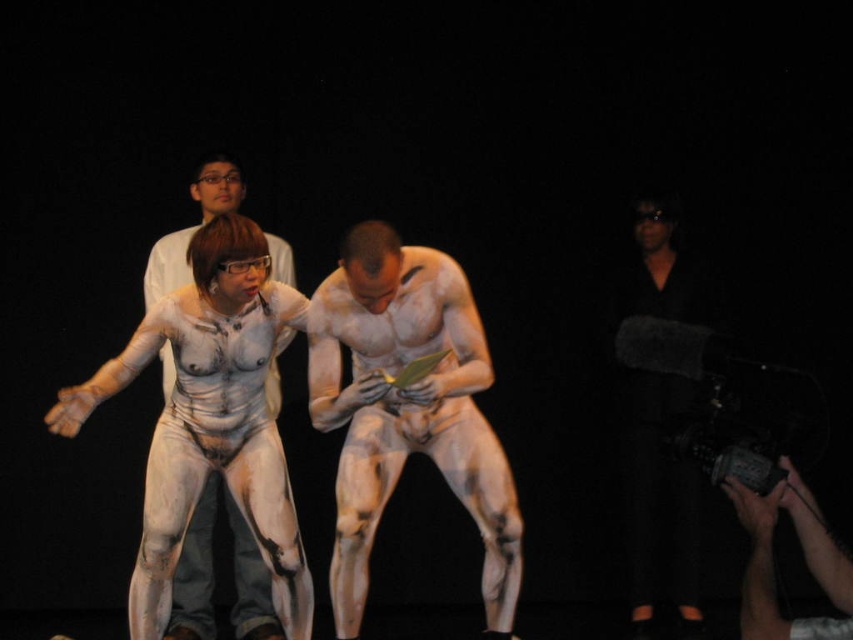
Locate an element on the screen. white matte body paint at center is located at coordinates click(407, 412).

Which of these two, white matte body paint at center or white body paint at center, stands shorter?

white body paint at center

Which is behind, point (460, 492) or point (194, 576)?

The point (194, 576) is behind.

I want to click on white matte body paint at center, so click(x=407, y=412).